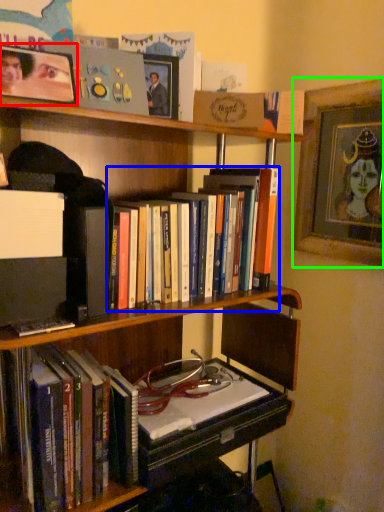
Question: Considering the real-world distances, which object is closest to picture frame (highlighted by a red box)? book (highlighted by a blue box) or picture frame (highlighted by a green box).

Choices:
 (A) book
 (B) picture frame

Answer: (A)